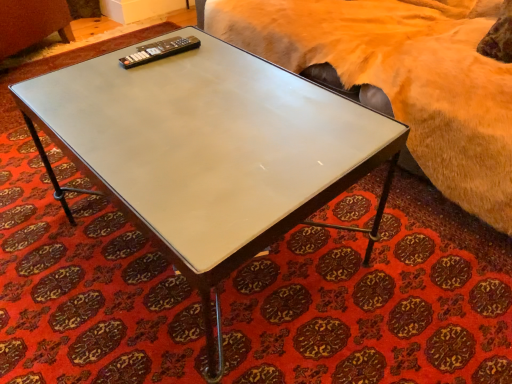
Locate an element on the screen. unoccupied region to the right of black plastic remote at upper left is located at coordinates (209, 57).